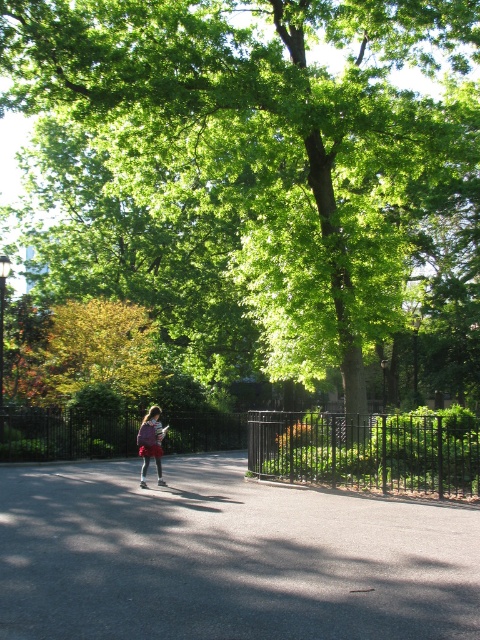
You are standing at the starting point of the pathway in the park. You see two points marked in the scene. Which point is closer to you, point [342,499] or point [145,449]?

Point [342,499] is in front of point [145,449], so it is closer to you.

You are standing at the entrance of the park and want to locate the green leafy tree at center. According to the coordinates provided, in which direction should you walk to reach it?

The green leafy tree at center is located at coordinates point (257,172). Since the coordinates are relative to the image, you should walk towards the center of the image to reach it.